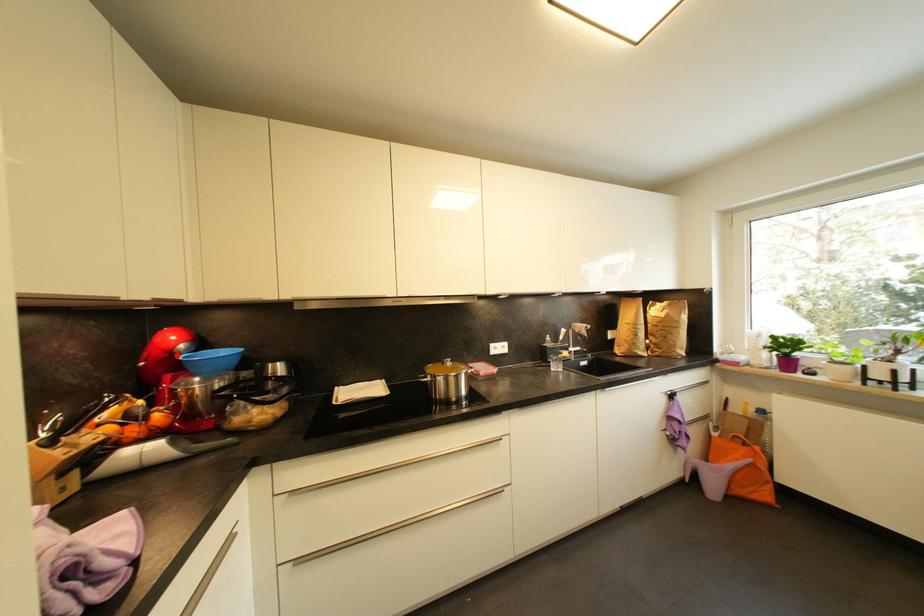
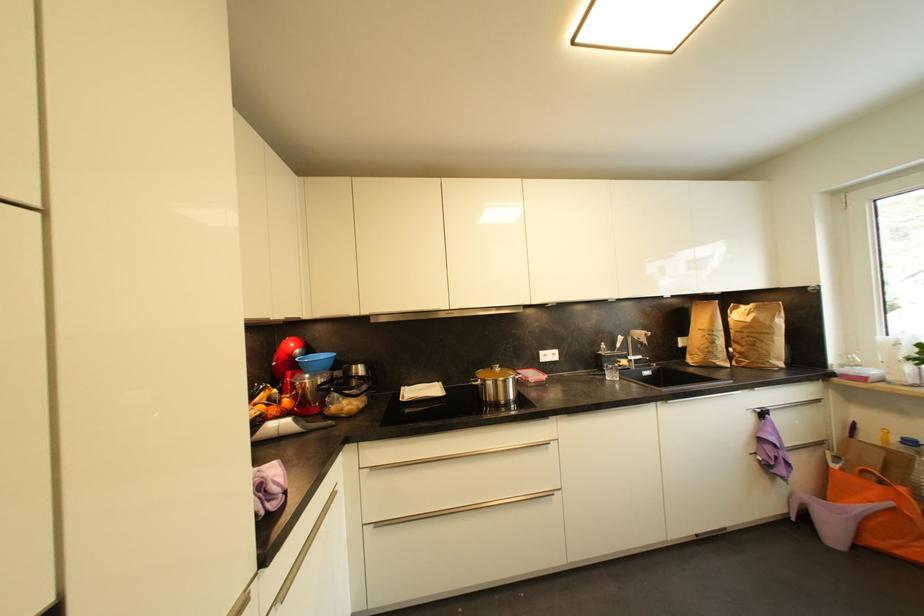
Where in the second image is the point corresponding to the highlighted location from the first image?

(297, 359)